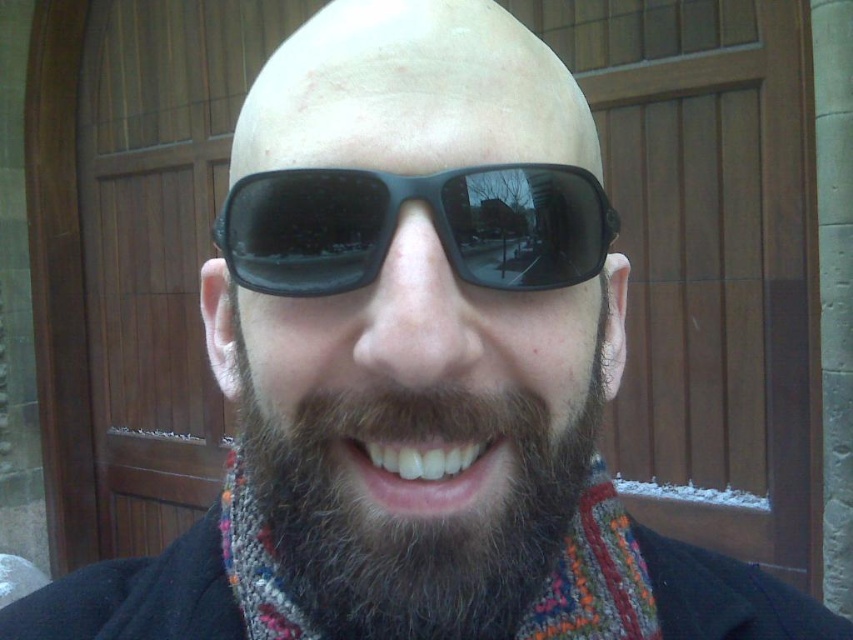
Question: Among these objects, which one is nearest to the camera?

Choices:
 (A) dark brown fuzzy beard at center
 (B) black plastic sunglasses at center

Answer: (A)

Question: Can you confirm if dark brown fuzzy beard at center is positioned to the right of black plastic sunglasses at center?

Choices:
 (A) no
 (B) yes

Answer: (A)

Question: In this image, where is dark brown fuzzy beard at center located relative to black plastic sunglasses at center?

Choices:
 (A) left
 (B) right

Answer: (A)

Question: Which point is farther from the camera taking this photo?

Choices:
 (A) (350, 228)
 (B) (416, 433)

Answer: (A)

Question: Is dark brown fuzzy beard at center closer to the viewer compared to black plastic sunglasses at center?

Choices:
 (A) yes
 (B) no

Answer: (A)